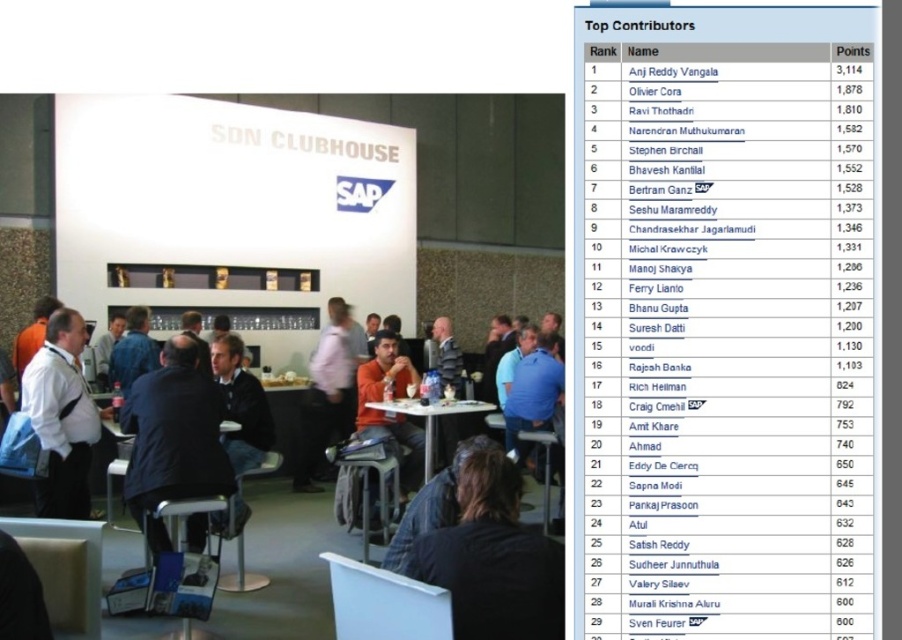
From the picture: Is dark brown leather jacket at lower center bigger than orange matte shirt at center?

Incorrect, dark brown leather jacket at lower center is not larger than orange matte shirt at center.

Is dark brown leather jacket at lower center to the right of orange matte shirt at center from the viewer's perspective?

Correct, you'll find dark brown leather jacket at lower center to the right of orange matte shirt at center.

Is point (470, 531) in front of point (403, 380)?

Yes, point (470, 531) is in front of point (403, 380).

Where is `dark brown leather jacket at lower center`? dark brown leather jacket at lower center is located at coordinates (493, 557).

Between white shirt at left and pink fabric shirt at center, which one appears on the right side from the viewer's perspective?

pink fabric shirt at center

Describe the element at coordinates (61, 417) in the screenshot. This screenshot has width=902, height=640. I see `white shirt at left` at that location.

The image size is (902, 640). I want to click on white shirt at left, so [x=61, y=417].

What are the coordinates of `white shirt at left` in the screenshot? It's located at (61, 417).

From the picture: Who is more forward, (57, 484) or (252, 387)?

Positioned in front is point (57, 484).

Is white shirt at left positioned before dark blue sweater at center?

Yes, it is.

Is point (40, 493) positioned after point (256, 394)?

No, it is in front of (256, 394).

Locate an element on the screen. white shirt at left is located at coordinates (61, 417).